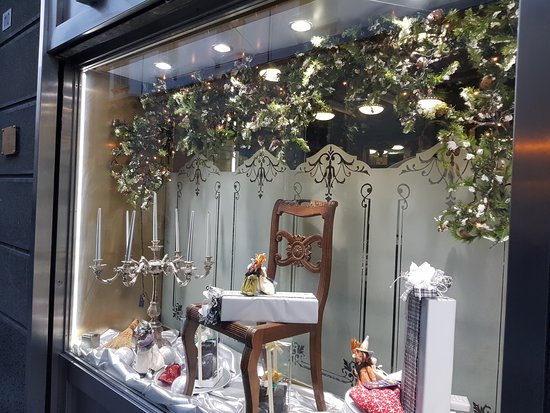
Find the location of a particular element. light is located at coordinates (376, 106), (324, 117), (432, 113), (304, 30), (272, 71), (222, 51), (165, 69).